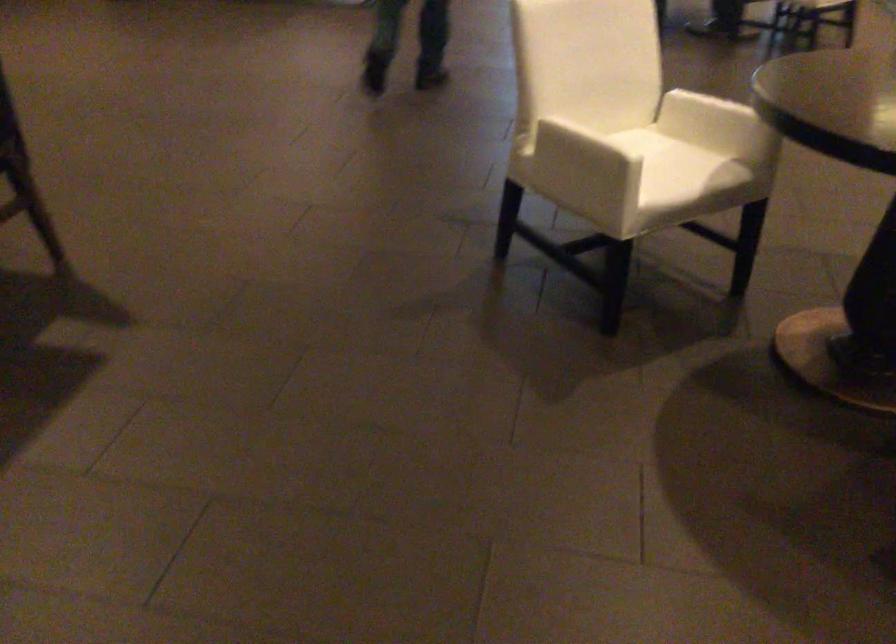
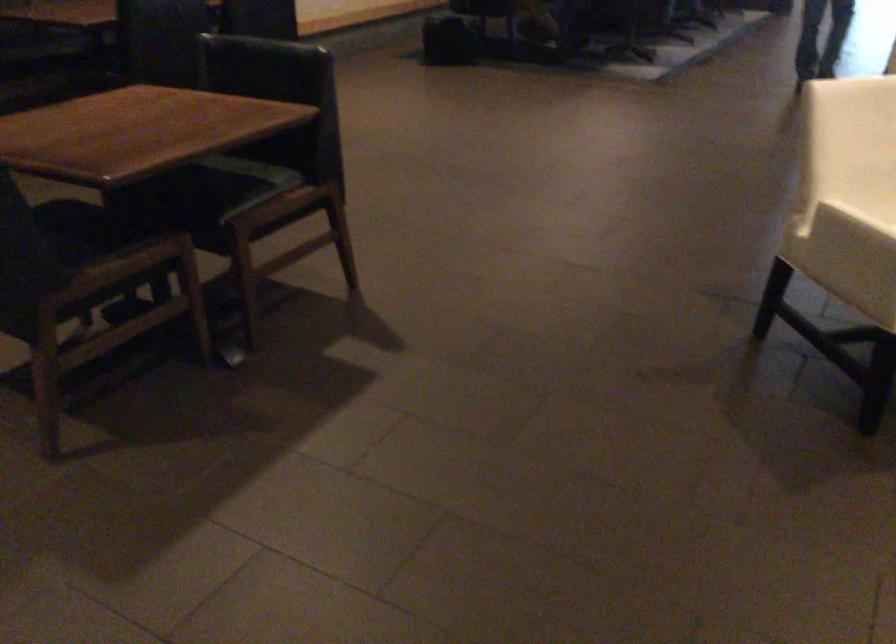
Which direction would the cameraman need to move to produce the second image?

Answer: The cameraman moved toward right, backward.